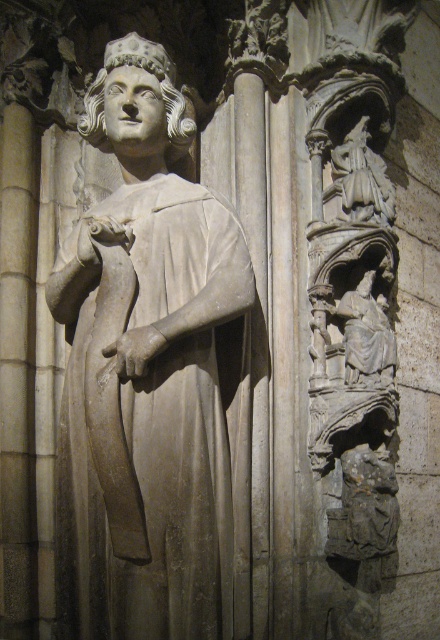
You are standing at the point marked at (376, 301). The sculpture is 6.30 feet away from you. If you want to touch the sculpture, how many steps would you need to take if each step covers 2.1 feet?

The sculpture is 6.30 feet away from the point marked at (376, 301). Since each step covers 2.1 feet, you would need to take 3 steps to reach the sculpture because 6.30 divided by 2.1 equals 3.

You are an art conservator examining two gray stone statues in a garden. You need to clean both the gray stone statue at center and the gray stone statue at right. Which statue should you clean first if you want to start with the one closer to the entrance?

The gray stone statue at center should be cleaned first because it is in front of the gray stone statue at right, meaning it is closer to the entrance.

You are a tour guide leading a group around an outdoor sculpture garden. You notice two gray stone statues, one at the center and one at the right. A visitor asks if they can safely walk between them. The path between them is narrow. The visitor is 20 inches wide. Can they pass through the space between the gray stone statue at center and the gray stone statue at right?

The gray stone statue at center and the gray stone statue at right are 15.55 inches apart. Since the visitor is 20 inches wide, they cannot pass through the space between them as the path is narrower than the visitor.